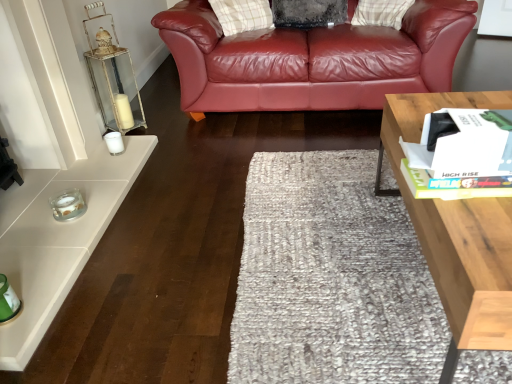
Question: Is point (109, 135) closer or farther from the camera than point (60, 206)?

Choices:
 (A) farther
 (B) closer

Answer: (A)

Question: Considering the positions of white glass candle at left, the first candle holder from the back, and clear glass candle at lower left, acting as the second candle holder starting from the top, in the image, is white glass candle at left, the first candle holder from the back, taller or shorter than clear glass candle at lower left, acting as the second candle holder starting from the top,?

Choices:
 (A) tall
 (B) short

Answer: (A)

Question: Estimate the real-world distances between objects in this image. Which object is closer to the white glass candle at left, arranged as the first candle holder when viewed from the top?

Choices:
 (A) light wood/texture coffee table at right
 (B) clear glass candle at lower left, acting as the second candle holder starting from the top

Answer: (B)

Question: Based on their relative distances, which object is nearer to the light wood/texture coffee table at right?

Choices:
 (A) white glass candle at left, marked as the 2th candle holder in a front-to-back arrangement
 (B) clear glass candle at lower left, which is counted as the 1th candle holder, starting from the bottom

Answer: (B)